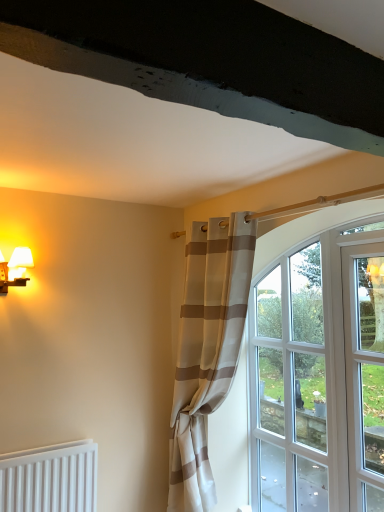
Question: From a real-world perspective, relative to clear glass window at center, is matte white table lamp at left vertically above or below?

Choices:
 (A) below
 (B) above

Answer: (B)

Question: Looking at their shapes, would you say matte white table lamp at left is wider or thinner than clear glass window at center?

Choices:
 (A) wide
 (B) thin

Answer: (A)

Question: Estimate the real-world distances between objects in this image. Which object is closer to the clear glass door at right?

Choices:
 (A) matte white table lamp at left
 (B) clear glass window at center
 (C) beige striped curtain at center

Answer: (B)

Question: Based on their relative distances, which object is nearer to the matte white table lamp at left?

Choices:
 (A) clear glass door at right
 (B) beige striped curtain at center
 (C) clear glass window at center

Answer: (B)